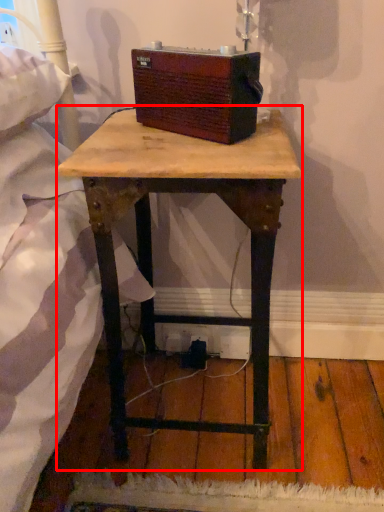
Question: From the image's perspective, where is table (annotated by the red box) located relative to box?

Choices:
 (A) below
 (B) above

Answer: (A)